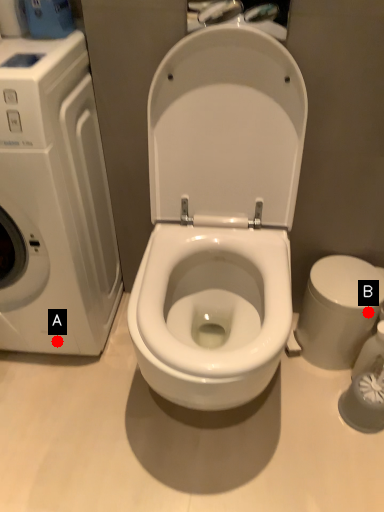
Question: Two points are circled on the image, labeled by A and B beside each circle. Which point is closer to the camera?

Choices:
 (A) A is closer
 (B) B is closer

Answer: (B)